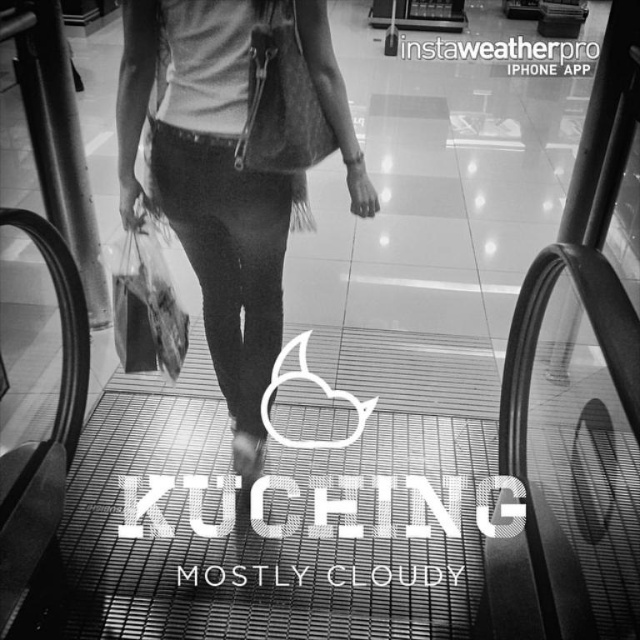
Can you confirm if suede bag at center is positioned above translucent plastic bag at center?

Indeed, suede bag at center is positioned over translucent plastic bag at center.

Between point (227, 172) and point (170, 330), which one is positioned in front?

Point (227, 172) is more forward.

I want to click on suede bag at center, so click(x=211, y=188).